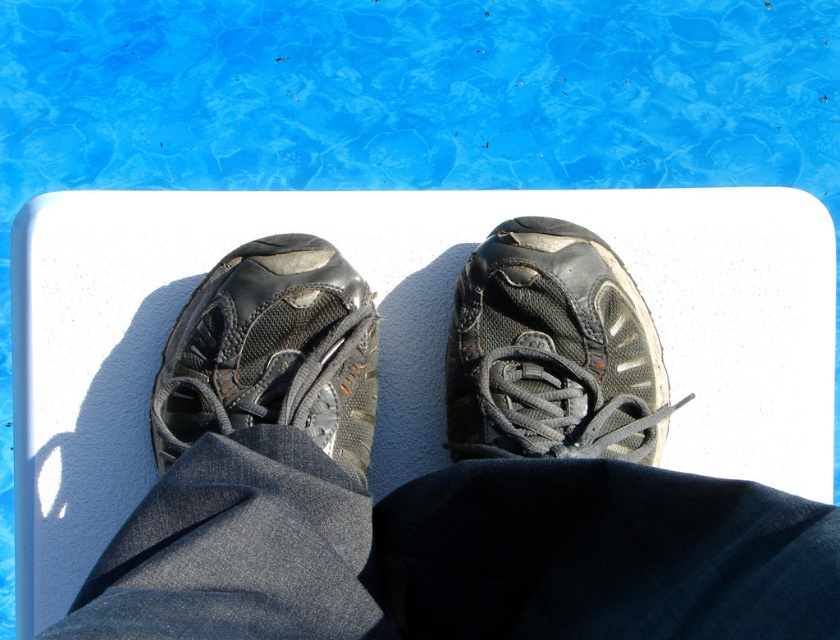
You are standing on the diving board and want to jump into the pool. Your left foot is at point [513,442] and your right foot is at point [332,372]. Which foot is closer to the edge of the diving board?

Point [513,442] is in front of point [332,372], so the left foot is closer to the edge of the diving board.